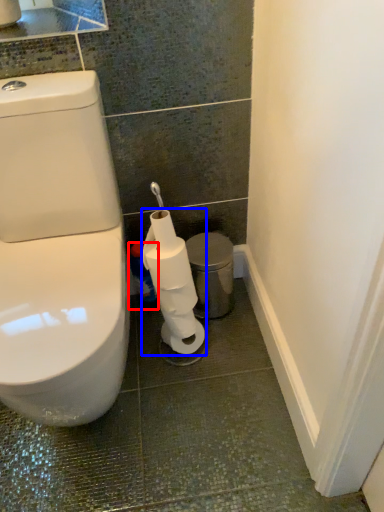
Question: Among these objects, which one is farthest to the camera, cleaning product (highlighted by a red box) or toilet paper (highlighted by a blue box)?

Choices:
 (A) cleaning product
 (B) toilet paper

Answer: (A)